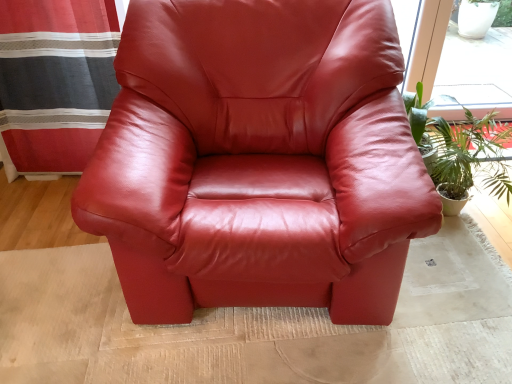
Image resolution: width=512 pixels, height=384 pixels. Find the location of `free space in front of green leafy plant at right`. free space in front of green leafy plant at right is located at coordinates (462, 286).